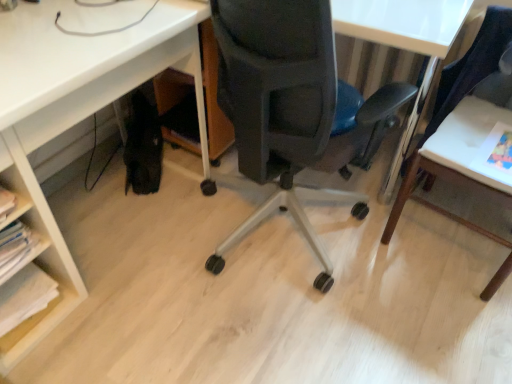
Question: Choose the correct answer: Is white matte desk at lower left inside white wood table at right or outside it?

Choices:
 (A) inside
 (B) outside

Answer: (B)

Question: Visually, is white matte desk at lower left positioned to the left or to the right of white wood table at right?

Choices:
 (A) left
 (B) right

Answer: (A)

Question: Based on their relative distances, which object is farther from the white wood table at right?

Choices:
 (A) white paper at lower left
 (B) matte black chair at center
 (C) white matte desk at lower left

Answer: (A)

Question: Which is nearer to the white wood table at right?

Choices:
 (A) matte black chair at center
 (B) white matte desk at lower left
 (C) white paper at lower left

Answer: (A)